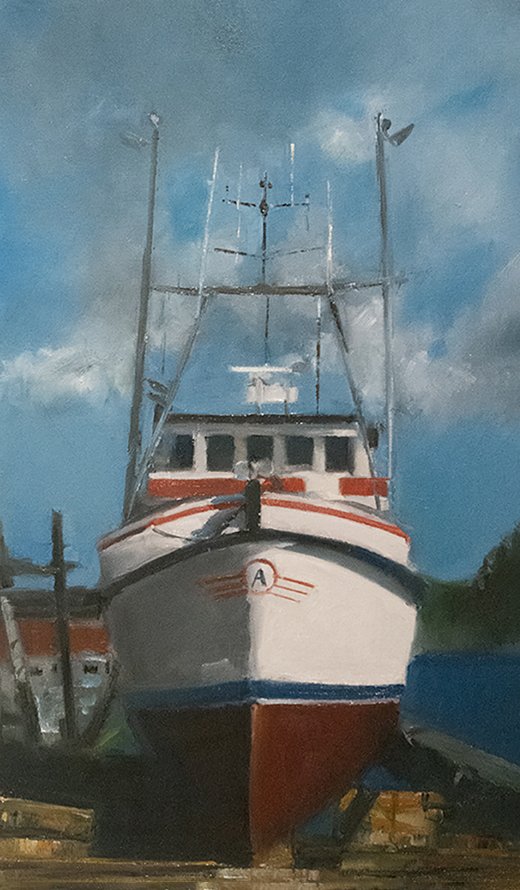
You are a GUI agent. You are given a task and a screenshot of the screen. Output one action in this format:
    pyautogui.click(x=<x>, y=<y>)
    Task: Click on the window of building left side
    
    Given the screenshot: What is the action you would take?
    pyautogui.click(x=90, y=667), pyautogui.click(x=34, y=672)